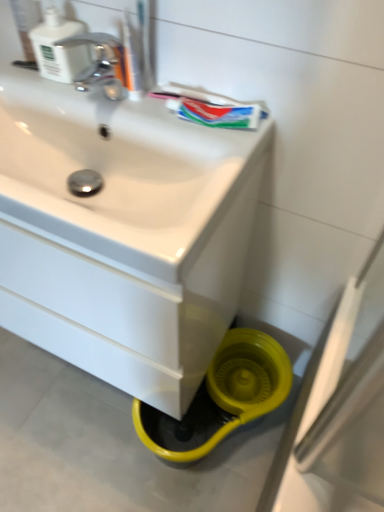
I want to click on vacant space situated on the left part of white plastic soap dispenser at upper left, so click(23, 72).